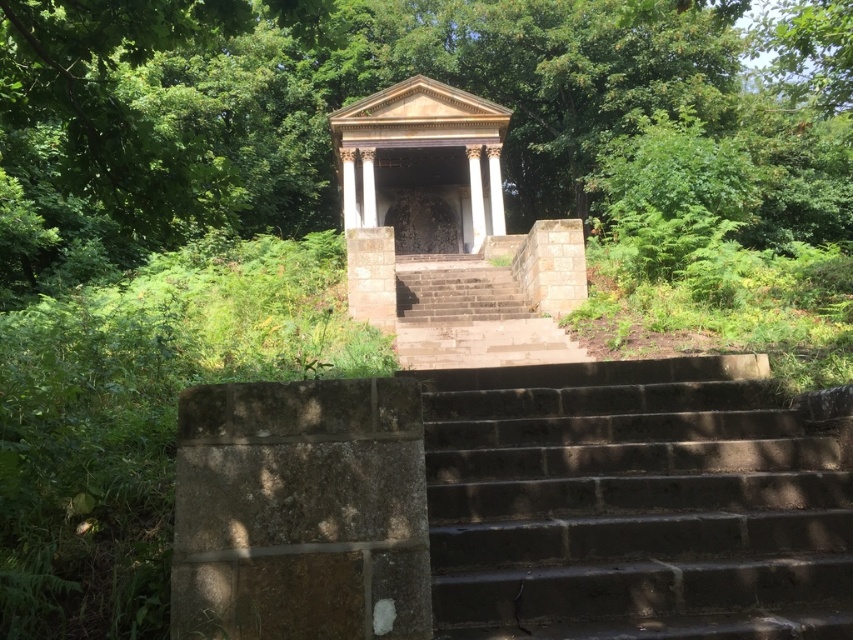
Question: Is dark gray concrete stairs at center in front of brown stone gazebo at center?

Choices:
 (A) yes
 (B) no

Answer: (A)

Question: Based on their relative distances, which object is nearer to the brown stone stairs at center?

Choices:
 (A) brown stone gazebo at center
 (B) dark gray concrete stairs at center
 (C) green leafy tree at upper center

Answer: (B)

Question: Where is green leafy tree at upper center located in relation to brown stone stairs at center in the image?

Choices:
 (A) above
 (B) below

Answer: (A)

Question: Estimate the real-world distances between objects in this image. Which object is closer to the dark gray concrete stairs at center?

Choices:
 (A) brown stone gazebo at center
 (B) brown stone stairs at center
 (C) green leafy tree at upper center

Answer: (B)

Question: Among these objects, which one is farthest from the camera?

Choices:
 (A) brown stone stairs at center
 (B) green leafy tree at upper center
 (C) dark gray concrete stairs at center
 (D) brown stone gazebo at center

Answer: (D)

Question: Does green leafy tree at upper center have a greater width compared to brown stone gazebo at center?

Choices:
 (A) no
 (B) yes

Answer: (B)